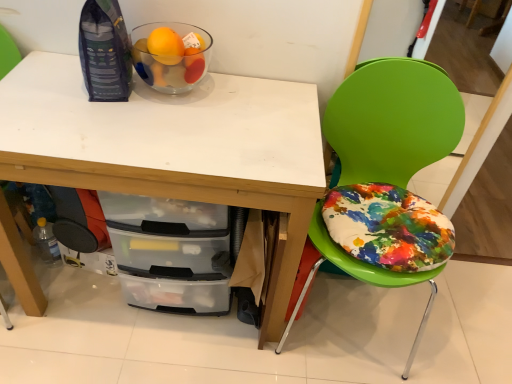
I want to click on vacant area situated below transparent glass bowl at upper left (from a real-world perspective), so coord(179,94).